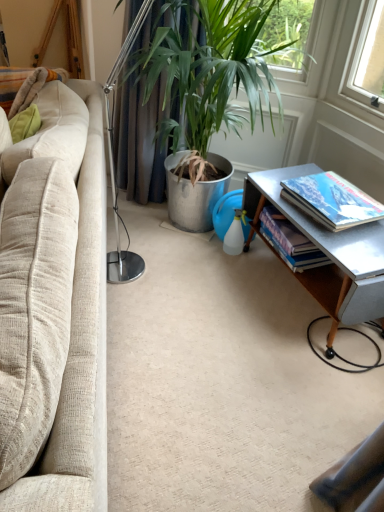
Question: Is hardcover book at right, the second book in the back-to-front sequence, facing towards hardcover book at lower right, placed as the second book when sorted from front to back?

Choices:
 (A) no
 (B) yes

Answer: (A)

Question: Is hardcover book at right, which is counted as the 1th book, starting from the front, positioned in front of hardcover book at lower right, placed as the second book when sorted from front to back?

Choices:
 (A) yes
 (B) no

Answer: (A)

Question: From a real-world perspective, does hardcover book at right, the second book in the back-to-front sequence, stand above hardcover book at lower right, which is counted as the first book, starting from the back?

Choices:
 (A) no
 (B) yes

Answer: (B)

Question: Does hardcover book at right, the second book in the back-to-front sequence, contain hardcover book at lower right, which is counted as the first book, starting from the back?

Choices:
 (A) yes
 (B) no

Answer: (B)

Question: Can you confirm if hardcover book at right, which is counted as the 1th book, starting from the front, is wider than hardcover book at lower right, placed as the second book when sorted from front to back?

Choices:
 (A) yes
 (B) no

Answer: (A)

Question: Is point (291, 228) closer or farther from the camera than point (342, 245)?

Choices:
 (A) farther
 (B) closer

Answer: (A)

Question: From the image's perspective, is hardcover book at lower right, placed as the second book when sorted from front to back, located above or below metallic silver table at lower right?

Choices:
 (A) above
 (B) below

Answer: (A)

Question: Relative to metallic silver table at lower right, is hardcover book at lower right, placed as the second book when sorted from front to back, in front or behind?

Choices:
 (A) behind
 (B) front

Answer: (A)

Question: Visually, is hardcover book at lower right, placed as the second book when sorted from front to back, positioned to the left or to the right of metallic silver table at lower right?

Choices:
 (A) right
 (B) left

Answer: (B)

Question: Considering the positions of beige fabric couch at left and hardcover book at lower right, placed as the second book when sorted from front to back, in the image, is beige fabric couch at left bigger or smaller than hardcover book at lower right, placed as the second book when sorted from front to back,?

Choices:
 (A) small
 (B) big

Answer: (B)

Question: Is beige fabric couch at left to the left or to the right of hardcover book at lower right, placed as the second book when sorted from front to back, in the image?

Choices:
 (A) right
 (B) left

Answer: (B)

Question: From the image's perspective, is beige fabric couch at left located above or below hardcover book at lower right, placed as the second book when sorted from front to back?

Choices:
 (A) above
 (B) below

Answer: (B)

Question: Considering the positions of point (99, 181) and point (276, 246), is point (99, 181) closer or farther from the camera than point (276, 246)?

Choices:
 (A) closer
 (B) farther

Answer: (A)

Question: Would you say beige fabric couch at left is to the left or to the right of green metallic plant pot at center in the picture?

Choices:
 (A) right
 (B) left

Answer: (B)

Question: From the image's perspective, is beige fabric couch at left positioned above or below green metallic plant pot at center?

Choices:
 (A) below
 (B) above

Answer: (A)